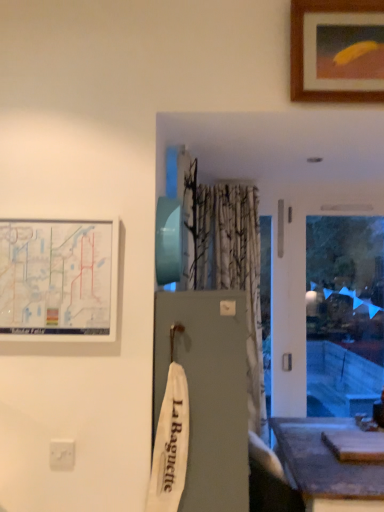
The image size is (384, 512). What do you see at coordinates (58, 280) in the screenshot? I see `white matte map at upper left, which is counted as the 2th picture frame, starting from the top` at bounding box center [58, 280].

Image resolution: width=384 pixels, height=512 pixels. Describe the element at coordinates (62, 454) in the screenshot. I see `white plastic electric outlet at lower left` at that location.

Find the location of a particular element. This screenshot has width=384, height=512. white matte map at upper left, placed as the 1th picture frame when sorted from left to right is located at coordinates (58, 280).

Does wooden picture frame at upper right, which is counted as the 2th picture frame, starting from the left, touch white plastic electric outlet at lower left?

No, wooden picture frame at upper right, which is counted as the 2th picture frame, starting from the left, is not touching white plastic electric outlet at lower left.

In the image, is wooden picture frame at upper right, the first picture frame viewed from the right, on the left side or the right side of white plastic electric outlet at lower left?

wooden picture frame at upper right, the first picture frame viewed from the right, is positioned on white plastic electric outlet at lower left's right side.

You are a GUI agent. You are given a task and a screenshot of the screen. Output one action in this format:
    pyautogui.click(x=<x>, y=<y>)
    Task: Click on the picture frame on the right side of white plastic electric outlet at lower left
    The image size is (384, 512).
    Given the screenshot: What is the action you would take?
    pyautogui.click(x=337, y=50)

From a real-world perspective, which object stands above the other?

wooden picture frame at upper right, which is counted as the 2th picture frame, starting from the left, is physically above.

Is wooden picture frame at upper right, which is the 2th picture frame from bottom to top, aimed at smooth gray table at lower right?

No, wooden picture frame at upper right, which is the 2th picture frame from bottom to top, is not oriented towards smooth gray table at lower right.

Is wooden picture frame at upper right, which is counted as the 2th picture frame, starting from the left, further to camera compared to smooth gray table at lower right?

No, wooden picture frame at upper right, which is counted as the 2th picture frame, starting from the left, is in front of smooth gray table at lower right.

You are a GUI agent. You are given a task and a screenshot of the screen. Output one action in this format:
    pyautogui.click(x=<x>, y=<y>)
    Task: Click on the table to the left of wooden picture frame at upper right, marked as the first picture frame in a top-to-bottom arrangement
    The image size is (384, 512).
    Given the screenshot: What is the action you would take?
    pyautogui.click(x=326, y=467)

Does white plastic electric outlet at lower left turn towards smooth gray table at lower right?

No, white plastic electric outlet at lower left is not turned towards smooth gray table at lower right.

From a real-world perspective, who is located higher, white plastic electric outlet at lower left or smooth gray table at lower right?

white plastic electric outlet at lower left.

Consider the image. Who is more distant, white plastic electric outlet at lower left or smooth gray table at lower right?

smooth gray table at lower right is further from the camera.

In the image, is white plastic electric outlet at lower left positioned in front of or behind wooden picture frame at upper right, which is the 2th picture frame from bottom to top?

Visually, white plastic electric outlet at lower left is located in front of wooden picture frame at upper right, which is the 2th picture frame from bottom to top.

Can you confirm if white plastic electric outlet at lower left is taller than wooden picture frame at upper right, the first picture frame viewed from the right?

No, white plastic electric outlet at lower left is not taller than wooden picture frame at upper right, the first picture frame viewed from the right.

You are a GUI agent. You are given a task and a screenshot of the screen. Output one action in this format:
    pyautogui.click(x=<x>, y=<y>)
    Task: Click on the electric outlet in front of the wooden picture frame at upper right, which is the 2th picture frame from bottom to top
    
    Given the screenshot: What is the action you would take?
    pyautogui.click(x=62, y=454)

Does white plastic electric outlet at lower left turn towards wooden picture frame at upper right, which is the 2th picture frame from bottom to top?

No, white plastic electric outlet at lower left is not facing towards wooden picture frame at upper right, which is the 2th picture frame from bottom to top.

From the image's perspective, is smooth gray table at lower right over white matte map at upper left, positioned as the second picture frame in right-to-left order?

No.

Is smooth gray table at lower right turned away from white matte map at upper left, marked as the 1th picture frame in a bottom-to-top arrangement?

That's not correct — smooth gray table at lower right is not looking away from white matte map at upper left, marked as the 1th picture frame in a bottom-to-top arrangement.

From a real-world perspective, between smooth gray table at lower right and white matte map at upper left, placed as the 1th picture frame when sorted from left to right, who is vertically lower?

smooth gray table at lower right, from a real-world perspective.

Which object is closer to the camera taking this photo, wooden picture frame at upper right, marked as the first picture frame in a top-to-bottom arrangement, or white matte map at upper left, marked as the 1th picture frame in a bottom-to-top arrangement?

white matte map at upper left, marked as the 1th picture frame in a bottom-to-top arrangement, is closer to the camera.

Considering the points (354, 17) and (5, 286), which point is in front, point (354, 17) or point (5, 286)?

Point (5, 286)

Between wooden picture frame at upper right, which is counted as the 2th picture frame, starting from the left, and white matte map at upper left, positioned as the second picture frame in right-to-left order, which one has larger width?

wooden picture frame at upper right, which is counted as the 2th picture frame, starting from the left, is wider.

Are wooden picture frame at upper right, which is counted as the 2th picture frame, starting from the left, and white matte map at upper left, marked as the 1th picture frame in a bottom-to-top arrangement, located far from each other?

wooden picture frame at upper right, which is counted as the 2th picture frame, starting from the left, is far away from white matte map at upper left, marked as the 1th picture frame in a bottom-to-top arrangement.

Considering the relative sizes of white matte map at upper left, which is counted as the 2th picture frame, starting from the top, and smooth gray table at lower right in the image provided, is white matte map at upper left, which is counted as the 2th picture frame, starting from the top, shorter than smooth gray table at lower right?

Yes, white matte map at upper left, which is counted as the 2th picture frame, starting from the top, is shorter than smooth gray table at lower right.

Is white matte map at upper left, marked as the 1th picture frame in a bottom-to-top arrangement, bigger or smaller than smooth gray table at lower right?

white matte map at upper left, marked as the 1th picture frame in a bottom-to-top arrangement, is smaller than smooth gray table at lower right.

From a real-world perspective, which object rests below the other?

smooth gray table at lower right is physically lower.

Where is `picture frame lying behind the white plastic electric outlet at lower left`? picture frame lying behind the white plastic electric outlet at lower left is located at coordinates (x=337, y=50).

Where is `table on the left of wooden picture frame at upper right, which is the 2th picture frame from bottom to top`? This screenshot has width=384, height=512. table on the left of wooden picture frame at upper right, which is the 2th picture frame from bottom to top is located at coordinates (326, 467).

From the image, which object appears to be nearer to smooth gray table at lower right, white plastic electric outlet at lower left or white matte map at upper left, positioned as the second picture frame in right-to-left order?

Among the two, white plastic electric outlet at lower left is located nearer to smooth gray table at lower right.

Looking at the image, which one is located further to white matte map at upper left, positioned as the second picture frame in right-to-left order, white plastic electric outlet at lower left or smooth gray table at lower right?

Among the two, smooth gray table at lower right is located further to white matte map at upper left, positioned as the second picture frame in right-to-left order.

From the image, which object appears to be nearer to white matte map at upper left, which is counted as the 2th picture frame, starting from the top, wooden picture frame at upper right, the first picture frame viewed from the right, or white plastic electric outlet at lower left?

Based on the image, white plastic electric outlet at lower left appears to be nearer to white matte map at upper left, which is counted as the 2th picture frame, starting from the top.

From the image, which object appears to be farther from white matte map at upper left, which is counted as the 2th picture frame, starting from the top, smooth gray table at lower right or white plastic electric outlet at lower left?

Based on the image, smooth gray table at lower right appears to be further to white matte map at upper left, which is counted as the 2th picture frame, starting from the top.

Based on the photo, estimate the real-world distances between objects in this image. Which object is further from wooden picture frame at upper right, which is the 2th picture frame from bottom to top, white matte map at upper left, marked as the 1th picture frame in a bottom-to-top arrangement, or white plastic electric outlet at lower left?

Among the two, white plastic electric outlet at lower left is located further to wooden picture frame at upper right, which is the 2th picture frame from bottom to top.

Considering their positions, is smooth gray table at lower right positioned further to white plastic electric outlet at lower left than wooden picture frame at upper right, which is the 2th picture frame from bottom to top?

wooden picture frame at upper right, which is the 2th picture frame from bottom to top, is positioned further to the anchor white plastic electric outlet at lower left.

Considering their positions, is white matte map at upper left, marked as the 1th picture frame in a bottom-to-top arrangement, positioned closer to smooth gray table at lower right than white plastic electric outlet at lower left?

white plastic electric outlet at lower left is closer to smooth gray table at lower right.

Estimate the real-world distances between objects in this image. Which object is further from white matte map at upper left, positioned as the second picture frame in right-to-left order, white plastic electric outlet at lower left or wooden picture frame at upper right, the first picture frame viewed from the right?

wooden picture frame at upper right, the first picture frame viewed from the right, lies further to white matte map at upper left, positioned as the second picture frame in right-to-left order, than the other object.

I want to click on picture frame between wooden picture frame at upper right, the first picture frame viewed from the right, and smooth gray table at lower right in the up-down direction, so click(x=58, y=280).

Find the location of a particular element. The width and height of the screenshot is (384, 512). electric outlet between white matte map at upper left, positioned as the second picture frame in right-to-left order, and smooth gray table at lower right is located at coordinates (62, 454).

Where is `electric outlet between wooden picture frame at upper right, marked as the first picture frame in a top-to-bottom arrangement, and smooth gray table at lower right vertically`? Image resolution: width=384 pixels, height=512 pixels. electric outlet between wooden picture frame at upper right, marked as the first picture frame in a top-to-bottom arrangement, and smooth gray table at lower right vertically is located at coordinates (62, 454).

At what (x,y) coordinates should I click in order to perform the action: click on picture frame between wooden picture frame at upper right, which is counted as the 2th picture frame, starting from the left, and white plastic electric outlet at lower left in the up-down direction. Please return your answer as a coordinate pair (x, y). Looking at the image, I should click on (58, 280).